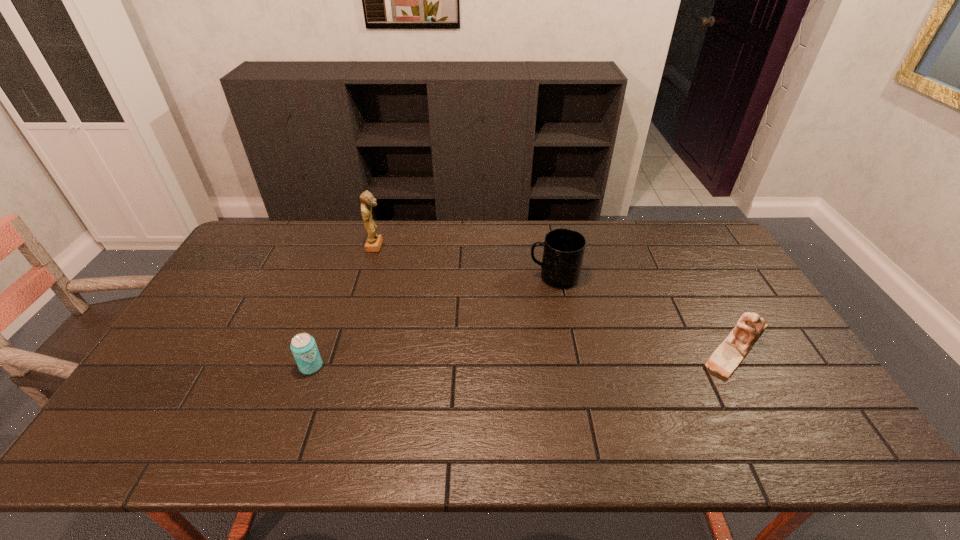
At what (x,y) coordinates should I click in order to perform the action: click on the taller figurine. Please return your answer as a coordinate pair (x, y). Looking at the image, I should click on (373, 243).

Where is `the farthest object`? The width and height of the screenshot is (960, 540). the farthest object is located at coordinates pos(373,243).

In order to click on the third object from left to right in this screenshot , I will do `click(564, 248)`.

Image resolution: width=960 pixels, height=540 pixels. What are the coordinates of `the second tallest object` in the screenshot? It's located at (564, 248).

Where is `the right figurine`? Image resolution: width=960 pixels, height=540 pixels. the right figurine is located at coordinates (727, 357).

You are a GUI agent. You are given a task and a screenshot of the screen. Output one action in this format:
    pyautogui.click(x=<x>, y=<y>)
    Task: Click on the third tallest object
    This screenshot has height=540, width=960.
    Given the screenshot: What is the action you would take?
    pyautogui.click(x=727, y=357)

I want to click on the leftmost object, so click(x=303, y=346).

Locate an element on the screen. This screenshot has height=540, width=960. beer can is located at coordinates (303, 346).

The height and width of the screenshot is (540, 960). I want to click on free space located 0.350m on the front-facing side of the farthest object, so [483, 246].

This screenshot has height=540, width=960. I want to click on vacant area situated on the side of the third object from left to right with the handle, so 514,277.